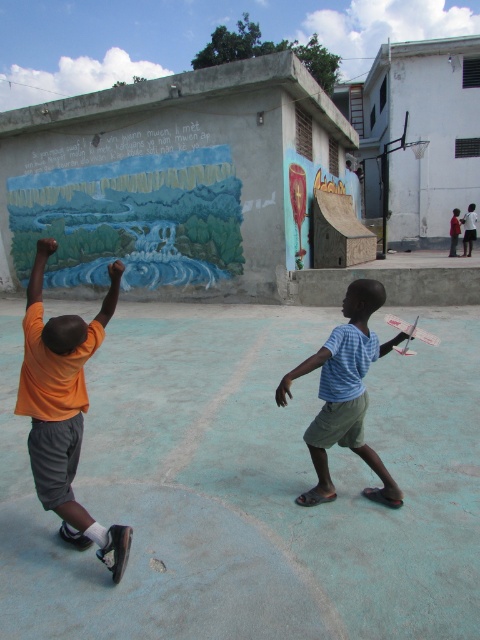
You are a photographer trying to capture a photo of both children in the scene. You want to ensure that the orange matte shirt at upper left and the blue striped shirt at center are both visible in the frame. Based on their positions, which child should you focus on first to ensure both are in the shot?

The orange matte shirt at upper left is positioned on the left side of the blue striped shirt at center. To ensure both are in the frame, focus on the orange matte shirt at upper left first, as it is further left, allowing the photographer to adjust the frame to include both children from left to right.

You are a photographer trying to capture a group photo of the orange matte shirt at upper left and the blue striped shirt at center. Which child should you position closer to the camera to ensure both appear equally sized in the photo?

You should position the orange matte shirt at upper left closer to the camera because it occupies less space than the blue striped shirt at center, making them appear the same size in the photo.